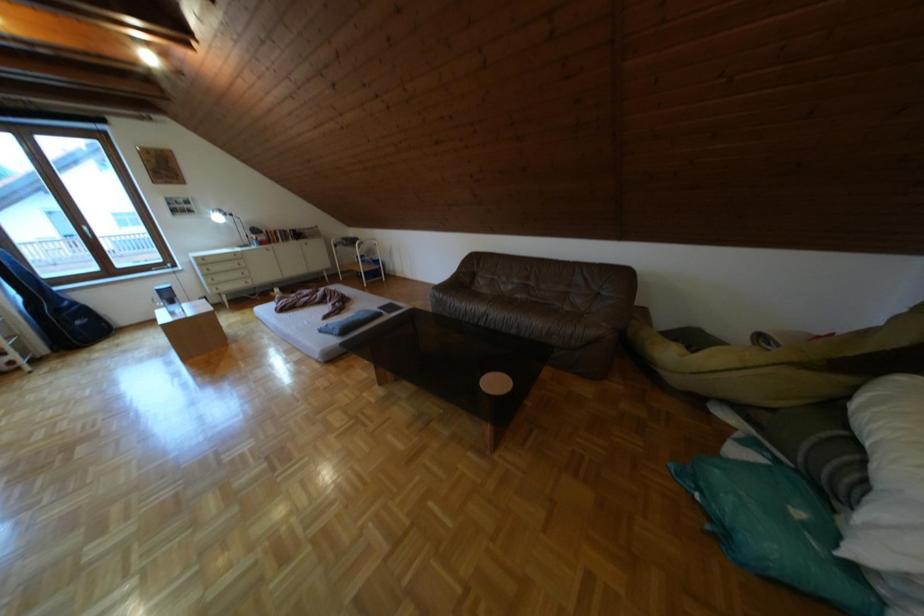
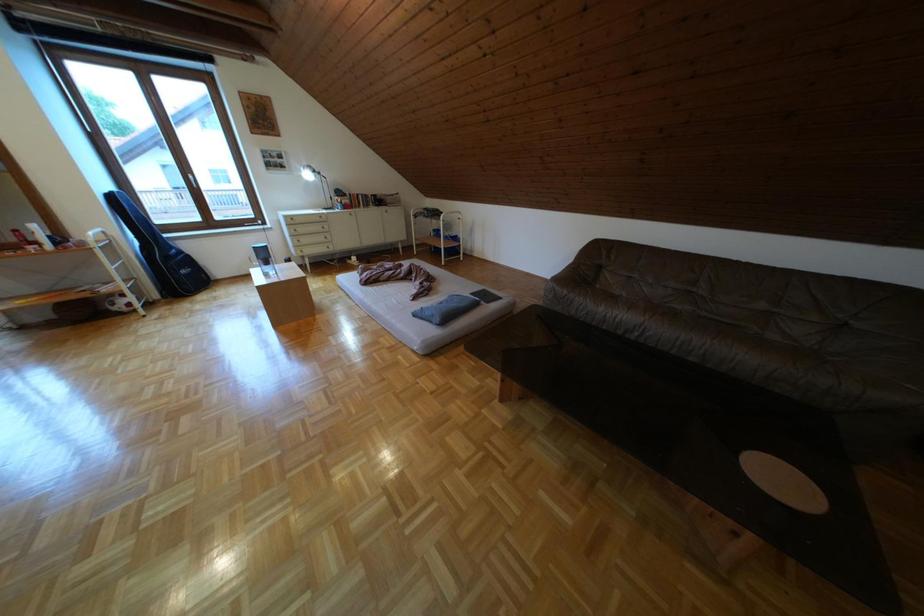
Question: The images are taken continuously from a first-person perspective. In which direction is your viewpoint rotating?

Choices:
 (A) Left
 (B) Right
 (C) Up
 (D) Down

Answer: (A)